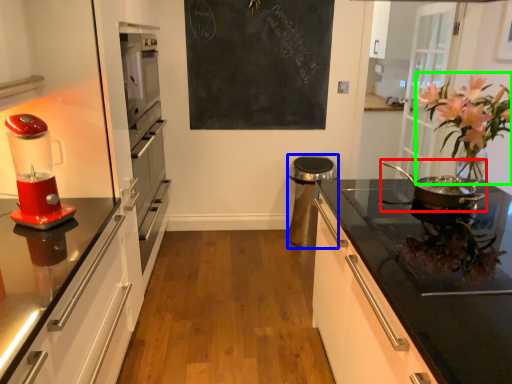
Question: Which is nearer to the kitchen appliance (highlighted by a red box)? appliance (highlighted by a blue box) or floral arrangement (highlighted by a green box).

Choices:
 (A) appliance
 (B) floral arrangement

Answer: (B)